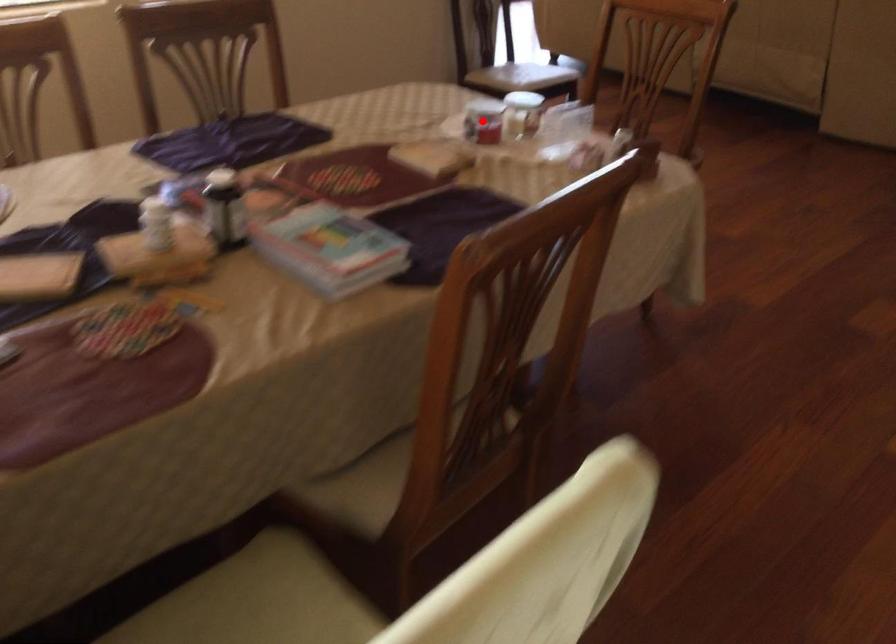
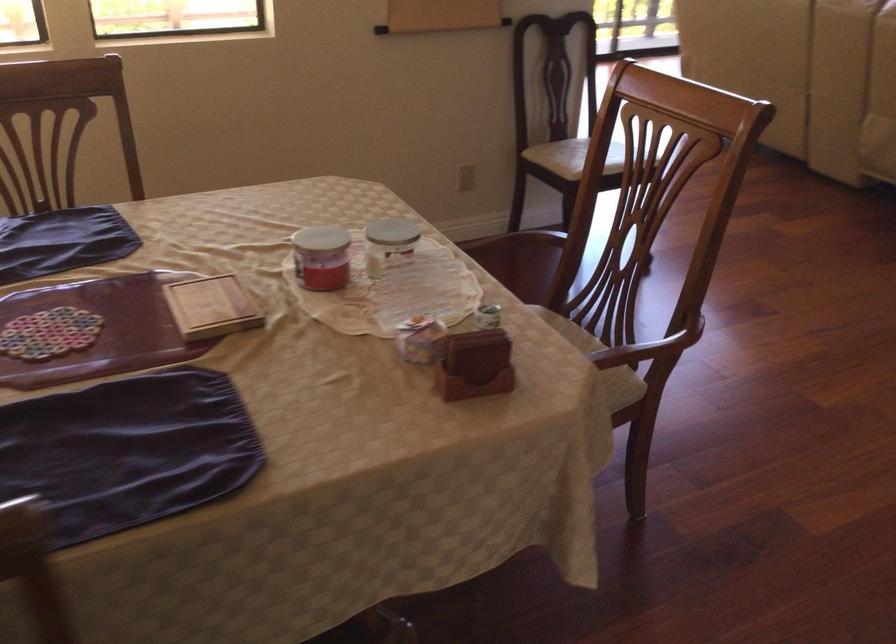
Question: I am providing you with two images of the same scene from different viewpoints. In image1, a red point is highlighted. Considering the same 3D point in image2, which of the following is correct?

Choices:
 (A) It is closer
 (B) It is farther

Answer: (A)